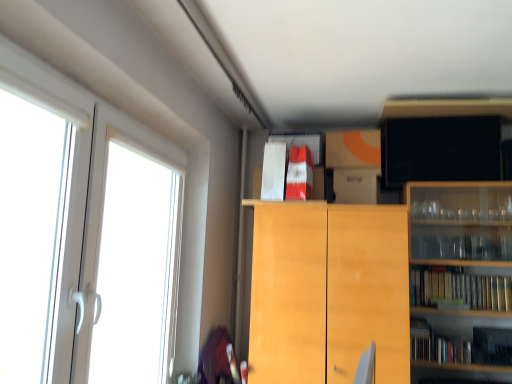
Question: Is hardcover books at right, the 3th book viewed from the top, shorter than black matte tv at upper right, positioned as the 4th cabinetry in bottom-to-top order?

Choices:
 (A) no
 (B) yes

Answer: (B)

Question: Does hardcover books at right, the first book from the right, have a smaller size compared to black matte tv at upper right, positioned as the 4th cabinetry in bottom-to-top order?

Choices:
 (A) yes
 (B) no

Answer: (B)

Question: Is hardcover books at right, the 3th book from the left, positioned far away from black matte tv at upper right, positioned as the 4th cabinetry in bottom-to-top order?

Choices:
 (A) no
 (B) yes

Answer: (A)

Question: From the image's perspective, does hardcover books at right, the 3th book from the left, appear lower than black matte tv at upper right, positioned as the 4th cabinetry in bottom-to-top order?

Choices:
 (A) no
 (B) yes

Answer: (B)

Question: Does hardcover books at right, the 3th book viewed from the top, have a greater height compared to black matte tv at upper right, positioned as the 4th cabinetry in bottom-to-top order?

Choices:
 (A) no
 (B) yes

Answer: (A)

Question: Is hardcover books at right, the 3th book viewed from the top, further to camera compared to black matte tv at upper right, marked as the 1th cabinetry in a top-to-bottom arrangement?

Choices:
 (A) yes
 (B) no

Answer: (A)

Question: Can you confirm if black matte tv at upper right, marked as the 1th cabinetry in a top-to-bottom arrangement, is positioned to the left of white paper bag at upper center, arranged as the third book when viewed from the right?

Choices:
 (A) yes
 (B) no

Answer: (B)

Question: Is black matte tv at upper right, marked as the 1th cabinetry in a top-to-bottom arrangement, shorter than white paper bag at upper center, acting as the first book starting from the left?

Choices:
 (A) yes
 (B) no

Answer: (B)

Question: Considering the relative sizes of black matte tv at upper right, marked as the 1th cabinetry in a top-to-bottom arrangement, and white paper bag at upper center, placed as the 2th book when sorted from top to bottom, in the image provided, is black matte tv at upper right, marked as the 1th cabinetry in a top-to-bottom arrangement, thinner than white paper bag at upper center, placed as the 2th book when sorted from top to bottom,?

Choices:
 (A) yes
 (B) no

Answer: (A)

Question: Considering the relative positions of black matte tv at upper right, positioned as the 4th cabinetry in bottom-to-top order, and white paper bag at upper center, the second book from the bottom, in the image provided, is black matte tv at upper right, positioned as the 4th cabinetry in bottom-to-top order, behind white paper bag at upper center, the second book from the bottom,?

Choices:
 (A) no
 (B) yes

Answer: (B)

Question: Is black matte tv at upper right, positioned as the 4th cabinetry in bottom-to-top order, turned away from white paper bag at upper center, acting as the first book starting from the left?

Choices:
 (A) no
 (B) yes

Answer: (A)

Question: Considering the relative sizes of black matte tv at upper right, marked as the 1th cabinetry in a top-to-bottom arrangement, and white paper bag at upper center, the second book from the bottom, in the image provided, is black matte tv at upper right, marked as the 1th cabinetry in a top-to-bottom arrangement, taller than white paper bag at upper center, the second book from the bottom,?

Choices:
 (A) yes
 (B) no

Answer: (A)

Question: Can you confirm if black matte tv at upper right, marked as the 1th cabinetry in a top-to-bottom arrangement, is wider than light wood cabinet at center, the 1th cabinetry positioned from the bottom?

Choices:
 (A) yes
 (B) no

Answer: (B)